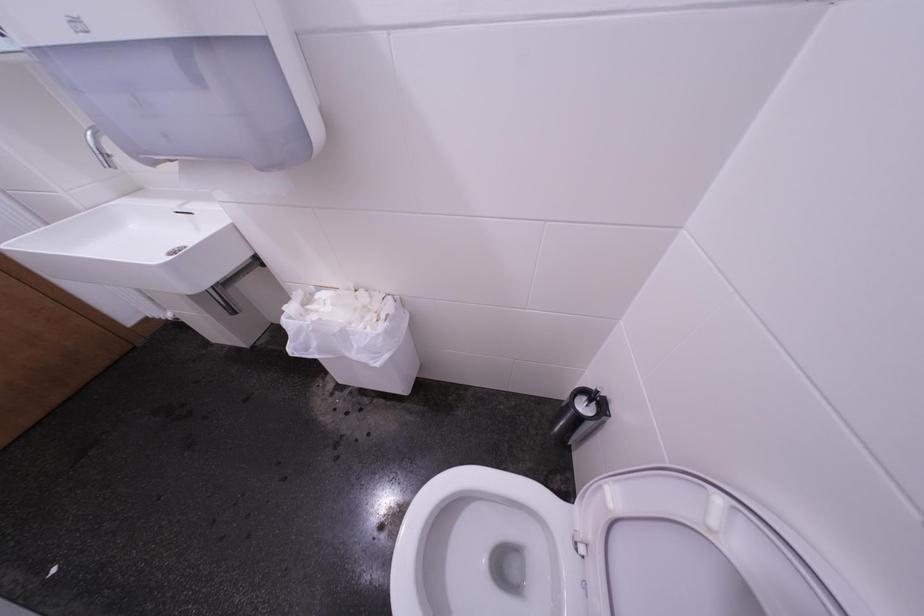
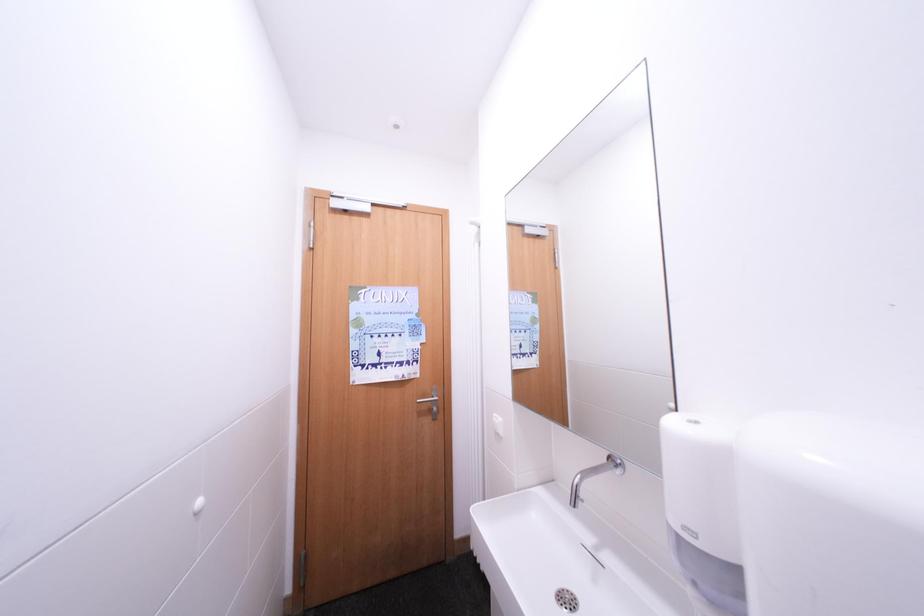
How did the camera likely rotate?

The rotation direction of the camera is left-up.